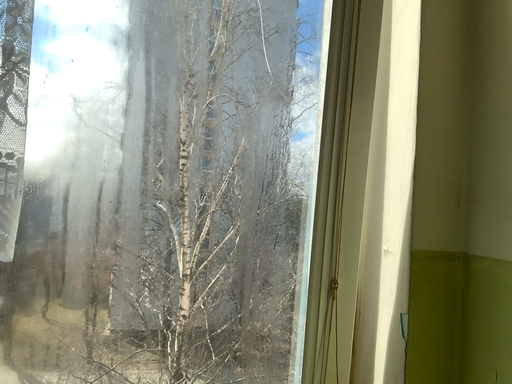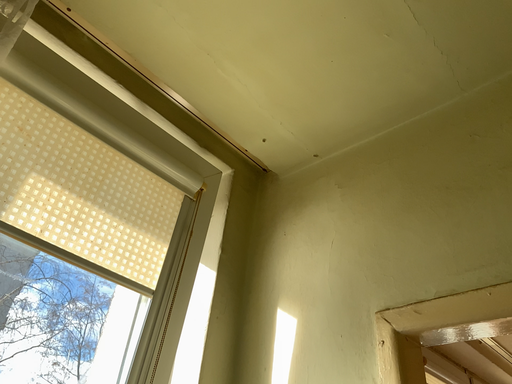
Question: How did the camera likely rotate when shooting the video?

Choices:
 (A) rotated downward
 (B) rotated upward

Answer: (B)